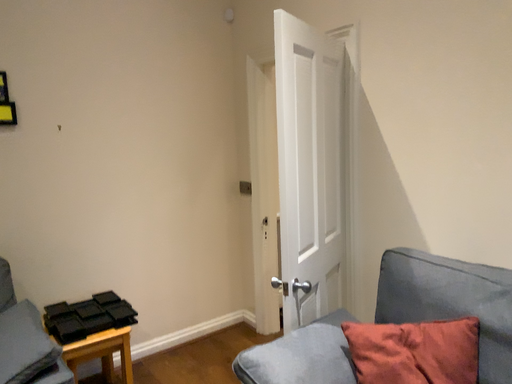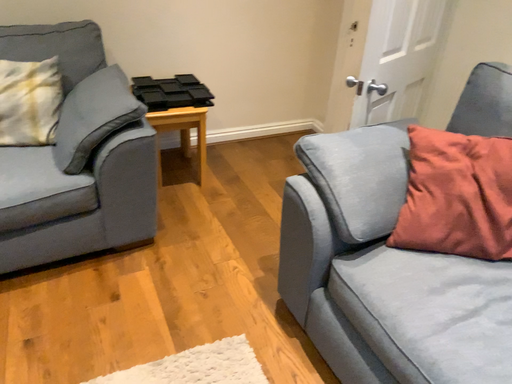
Question: How did the camera likely rotate when shooting the video?

Choices:
 (A) rotated left
 (B) rotated right

Answer: (A)